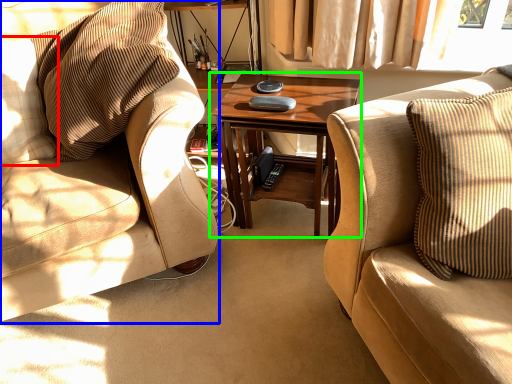
Question: Which is nearer to the pillow (highlighted by a red box)? chair (highlighted by a blue box) or coffee table (highlighted by a green box).

Choices:
 (A) chair
 (B) coffee table

Answer: (A)